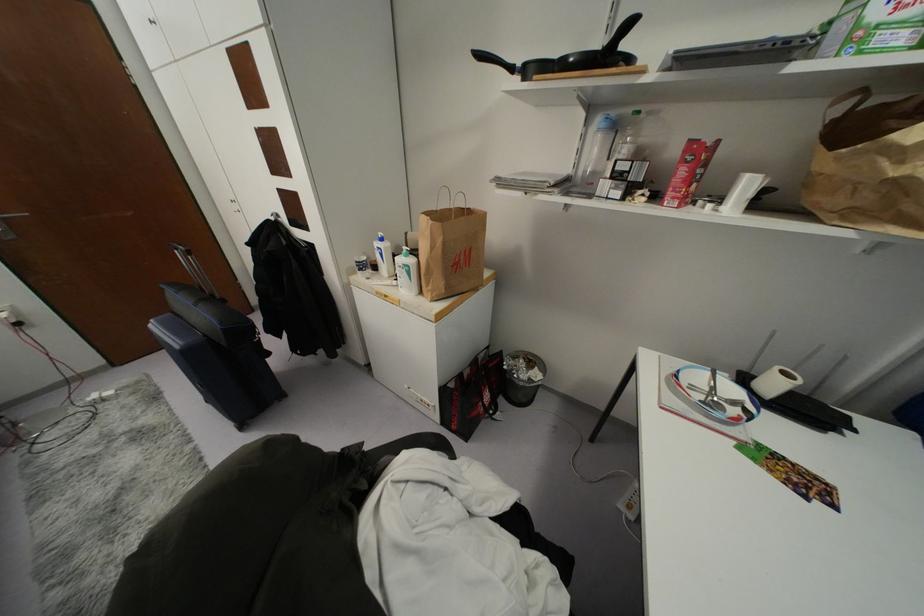
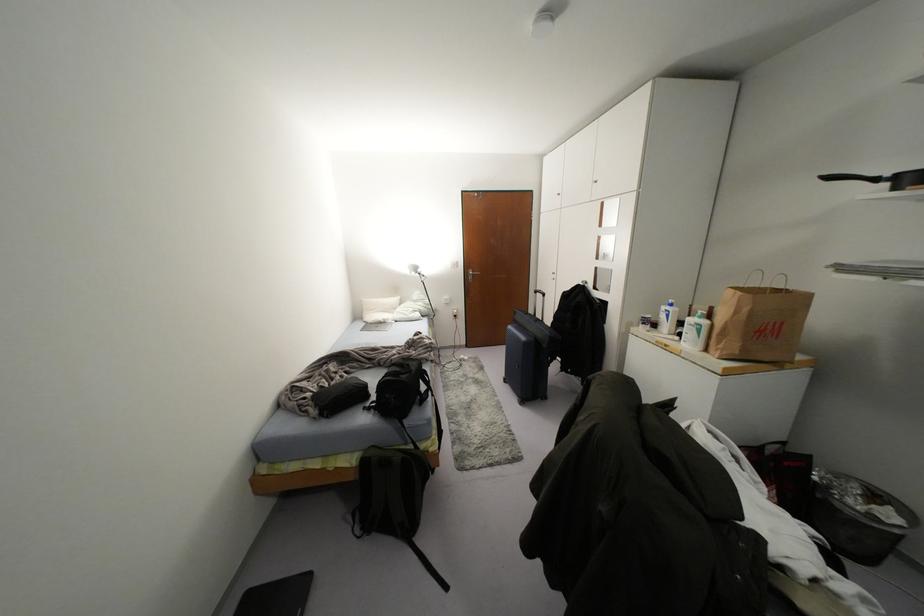
Locate, in the second image, the point that corresponds to pixel 479 55 in the first image.

(829, 177)